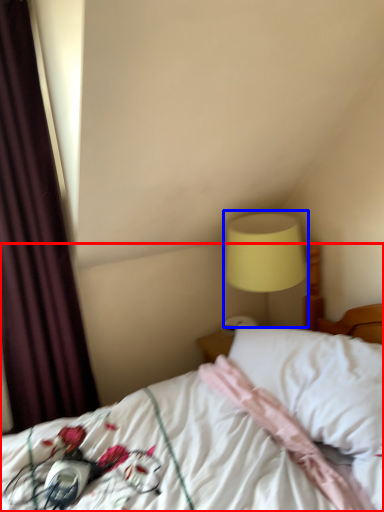
Question: Which of the following is the farthest to the observer, bed (highlighted by a red box) or bedside lamp (highlighted by a blue box)?

Choices:
 (A) bed
 (B) bedside lamp

Answer: (B)